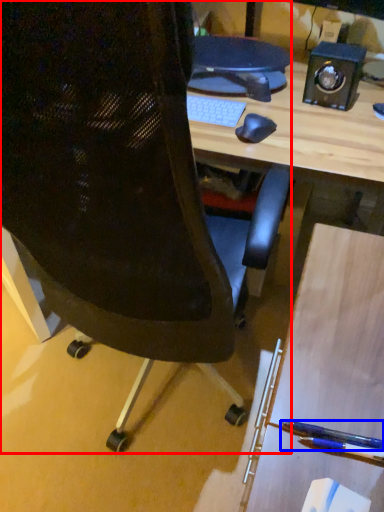
Question: Which object is closer to the camera taking this photo, chair (highlighted by a red box) or penguin (highlighted by a blue box)?

Choices:
 (A) chair
 (B) penguin

Answer: (A)